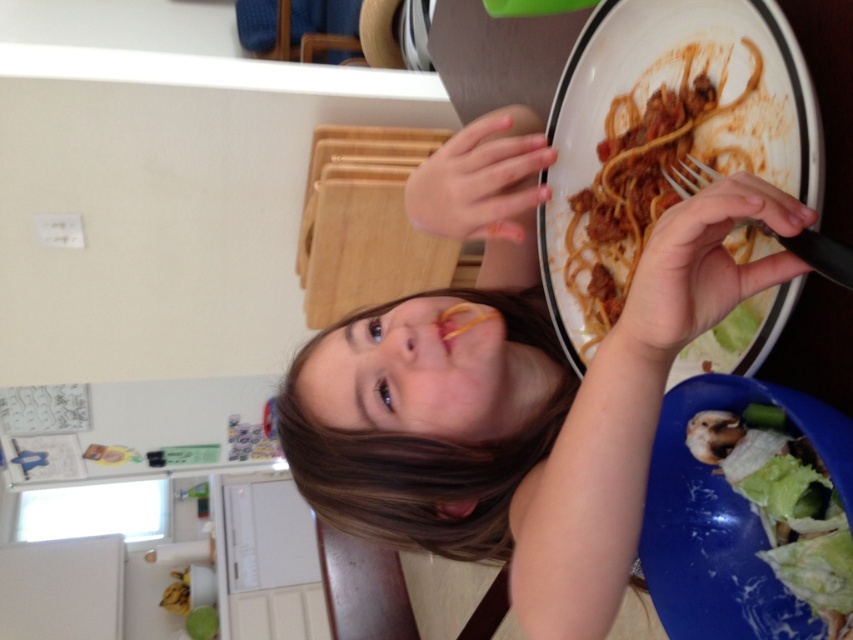
Does point (672, 52) lie behind point (851, 275)?

Yes, it is.

Who is more forward, (x=604, y=128) or (x=762, y=221)?

Point (x=762, y=221) is in front.

At what (x,y) coordinates should I click in order to perform the action: click on brown matte spaghetti at center. Please return your answer as a coordinate pair (x, y). Looking at the image, I should click on (654, 166).

Does smooth brown hair at center appear on the right side of brown matte spaghetti at center?

No, smooth brown hair at center is not to the right of brown matte spaghetti at center.

Is point (409, 483) farther from camera compared to point (598, 243)?

No, it is in front of (598, 243).

What do you see at coordinates (515, 385) in the screenshot? The width and height of the screenshot is (853, 640). I see `smooth brown hair at center` at bounding box center [515, 385].

Where is `smooth brown hair at center`? The height and width of the screenshot is (640, 853). smooth brown hair at center is located at coordinates (515, 385).

How far apart are smooth brown hair at center and green leafy vegetable at lower right?

smooth brown hair at center is 9.57 inches from green leafy vegetable at lower right.

Is point (459, 420) positioned after point (845, 596)?

Yes.

Who is more forward, (525, 141) or (805, 577)?

Positioned in front is point (805, 577).

Identify the location of smooth brown hair at center. pyautogui.click(x=515, y=385).